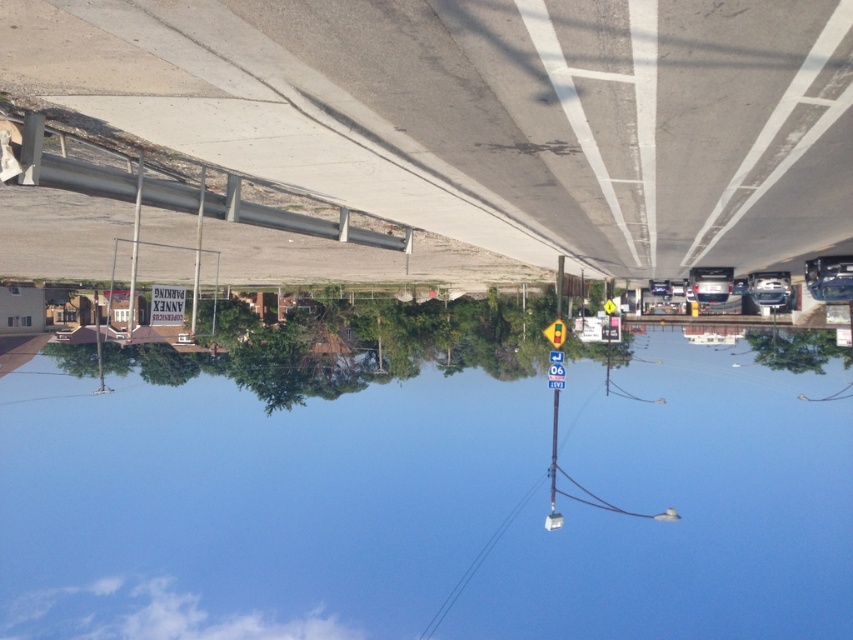
Based on the provided image, what is the 2D coordinate of the transparent glass water at center?

The 2D coordinate of the transparent glass water at center is at point (428, 496).

You are standing at the rotated image of a street intersection. You see a point marked at coordinates (488, 113). Based on the scene description, where is this point located?

The point at (488, 113) is on the concrete overpass at center.